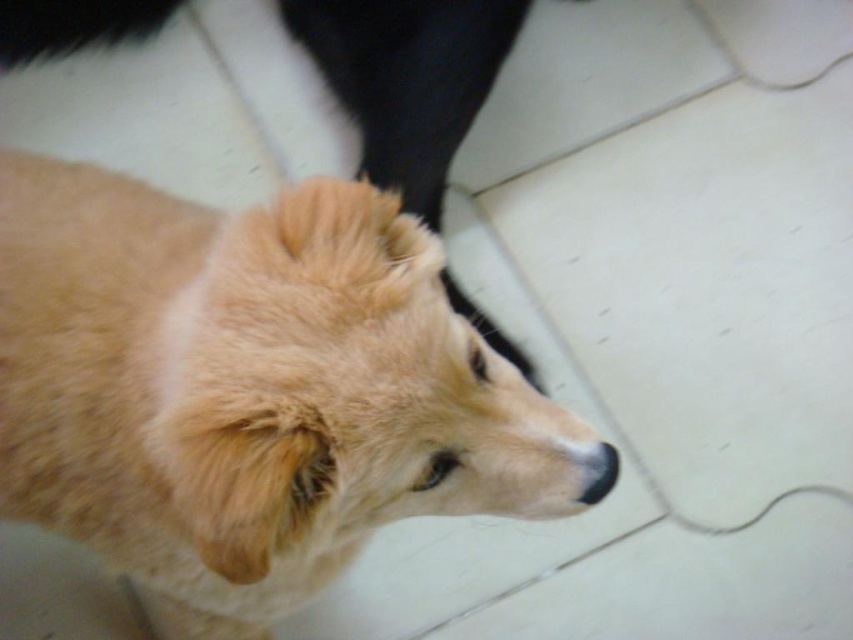
Who is more forward, [113,476] or [4,12]?

Point [113,476] is in front.

Identify the location of fuzzy golden dog at center. Image resolution: width=853 pixels, height=640 pixels. (250, 388).

Locate an element on the screen. This screenshot has height=640, width=853. fuzzy golden dog at center is located at coordinates (250, 388).